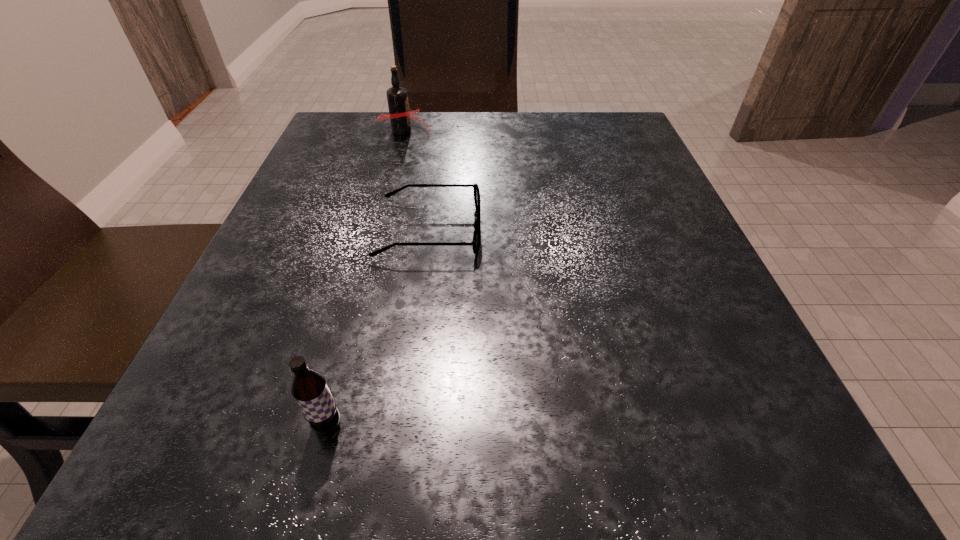
This screenshot has height=540, width=960. In order to click on the second closest object to the shorter root beer in this screenshot , I will do `click(400, 116)`.

This screenshot has width=960, height=540. I want to click on the closest object to the nearer root beer, so tap(477, 223).

What are the coordinates of `blank space that satisfies the following two spatial constraints: 1. on the label of the farther root beer; 2. on the back side of the shorter root beer` in the screenshot? It's located at (325, 424).

This screenshot has width=960, height=540. I want to click on vacant space that satisfies the following two spatial constraints: 1. on the label of the nearest object; 2. on the right side of the farthest object, so click(x=325, y=424).

The height and width of the screenshot is (540, 960). What are the coordinates of `free space that satisfies the following two spatial constraints: 1. on the front-facing side of the shortest object; 2. on the front side of the second shortest object` in the screenshot? It's located at (405, 424).

The height and width of the screenshot is (540, 960). What are the coordinates of `free space in the image that satisfies the following two spatial constraints: 1. on the label of the shorter root beer; 2. on the left side of the farther root beer` in the screenshot? It's located at (325, 424).

The height and width of the screenshot is (540, 960). Identify the location of free space that satisfies the following two spatial constraints: 1. on the front-facing side of the second nearest object; 2. on the front side of the nearer root beer. click(x=405, y=424).

At what (x,y) coordinates should I click in order to perform the action: click on vacant area that satisfies the following two spatial constraints: 1. on the label of the farther root beer; 2. on the left side of the second shortest object. Please return your answer as a coordinate pair (x, y). Looking at the image, I should click on (325, 424).

What are the coordinates of `free space that satisfies the following two spatial constraints: 1. on the label of the shorter root beer; 2. on the right side of the farther root beer` in the screenshot? It's located at coord(325,424).

Where is `vacant space that satisfies the following two spatial constraints: 1. on the label of the shorter root beer; 2. on the right side of the farthest object`? This screenshot has width=960, height=540. vacant space that satisfies the following two spatial constraints: 1. on the label of the shorter root beer; 2. on the right side of the farthest object is located at coordinates (325, 424).